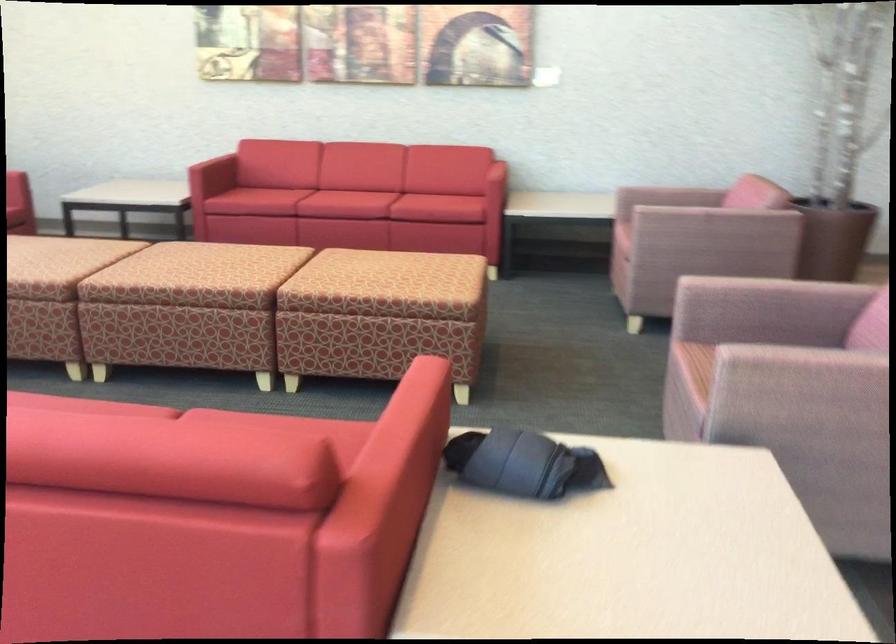
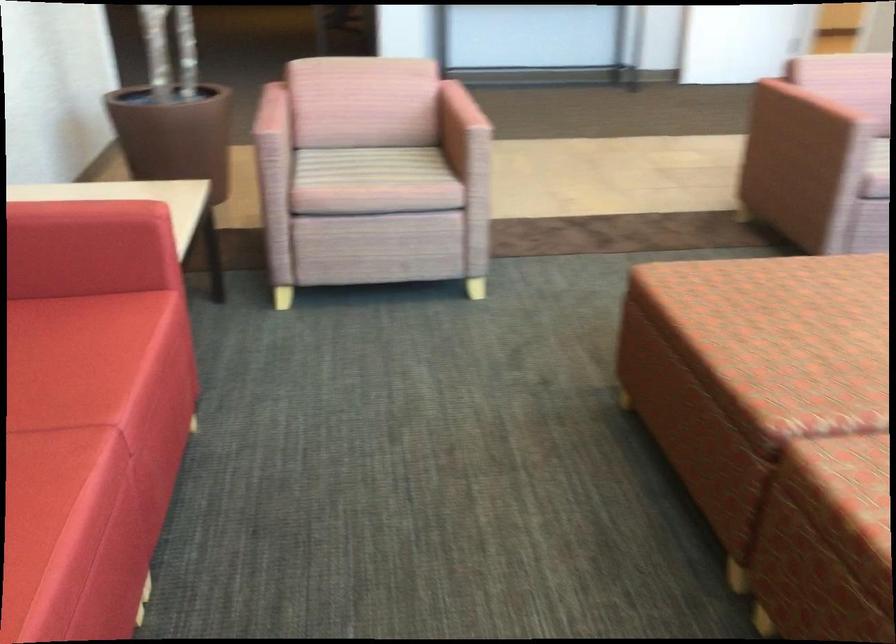
In the second image, find the point that corresponds to (421,259) in the first image.

(805, 304)